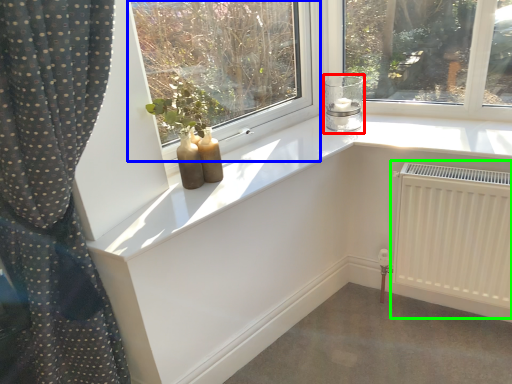
Question: Which is farther away from candle holder (highlighted by a red box)? window (highlighted by a blue box) or radiator (highlighted by a green box)?

Choices:
 (A) window
 (B) radiator

Answer: (A)